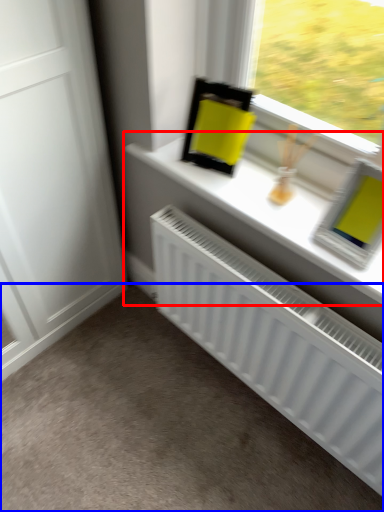
Question: Which object appears closest to the camera in this image, window sill (highlighted by a red box) or plain (highlighted by a blue box)?

Choices:
 (A) window sill
 (B) plain

Answer: (B)